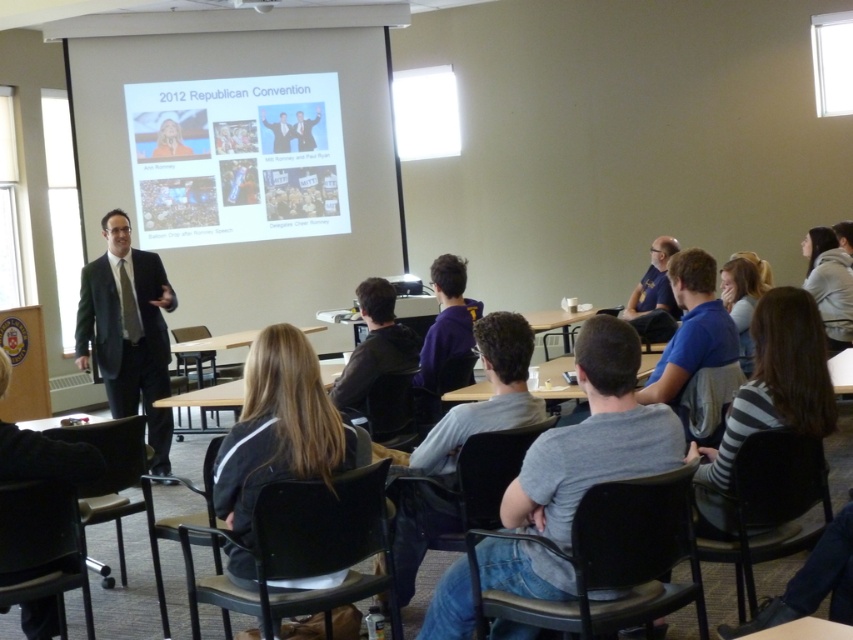
Does dark gray suit at left appear on the left side of black plastic projector at upper center?

Indeed, dark gray suit at left is positioned on the left side of black plastic projector at upper center.

Who is taller, dark gray suit at left or black plastic projector at upper center?

dark gray suit at left is taller.

Which is behind, point (115, 310) or point (416, 292)?

Positioned behind is point (416, 292).

At what (x,y) coordinates should I click in order to perform the action: click on dark gray suit at left. Please return your answer as a coordinate pair (x, y). The height and width of the screenshot is (640, 853). Looking at the image, I should click on (128, 332).

Locate an element on the screen. gray cotton shirt at center is located at coordinates (593, 436).

Between gray cotton shirt at center and blue fabric shirt at center, which one is positioned higher?

blue fabric shirt at center is above.

Between point (434, 596) and point (648, 326), which one is positioned in front?

Positioned in front is point (434, 596).

The height and width of the screenshot is (640, 853). What are the coordinates of `gray cotton shirt at center` in the screenshot? It's located at (593, 436).

Can you confirm if dark gray suit at left is wider than dark gray hoodie at center?

Correct, the width of dark gray suit at left exceeds that of dark gray hoodie at center.

Between point (108, 310) and point (347, 410), which one is positioned in front?

Positioned in front is point (347, 410).

Is point (160, 307) closer to viewer compared to point (367, 292)?

No, it is behind (367, 292).

What are the coordinates of `dark gray suit at left` in the screenshot? It's located at (128, 332).